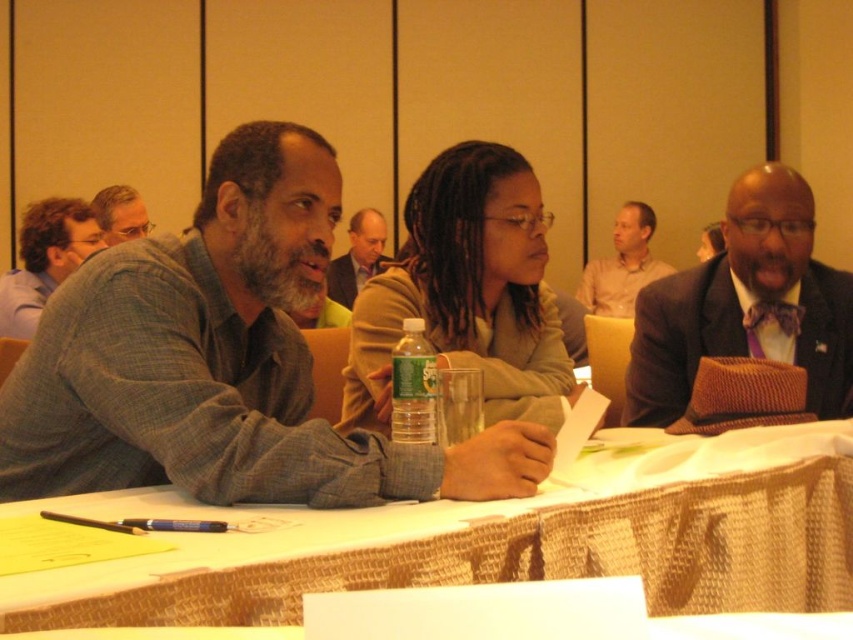
Is point (585, 522) closer to viewer compared to point (425, 356)?

That is True.

From the picture: Is white woven tablecloth at center wider than clear plastic bottle at center?

Indeed, white woven tablecloth at center has a greater width compared to clear plastic bottle at center.

You are a GUI agent. You are given a task and a screenshot of the screen. Output one action in this format:
    pyautogui.click(x=<x>, y=<y>)
    Task: Click on the white woven tablecloth at center
    The image size is (853, 640).
    Given the screenshot: What is the action you would take?
    pyautogui.click(x=515, y=541)

Locate an element on the screen. This screenshot has height=640, width=853. white woven tablecloth at center is located at coordinates (515, 541).

Between white woven tablecloth at center and light brown shirt at upper center, which one appears on the right side from the viewer's perspective?

From the viewer's perspective, light brown shirt at upper center appears more on the right side.

This screenshot has width=853, height=640. Identify the location of white woven tablecloth at center. (515, 541).

Is gray plaid shirt at left bigger than gray flannel shirt at left?

Correct, gray plaid shirt at left is larger in size than gray flannel shirt at left.

Which is in front, point (277, 374) or point (99, 236)?

Point (277, 374) is in front.

Who is more distant from viewer, (38, 333) or (76, 250)?

The point (76, 250) is behind.

This screenshot has width=853, height=640. I want to click on gray plaid shirt at left, so click(222, 362).